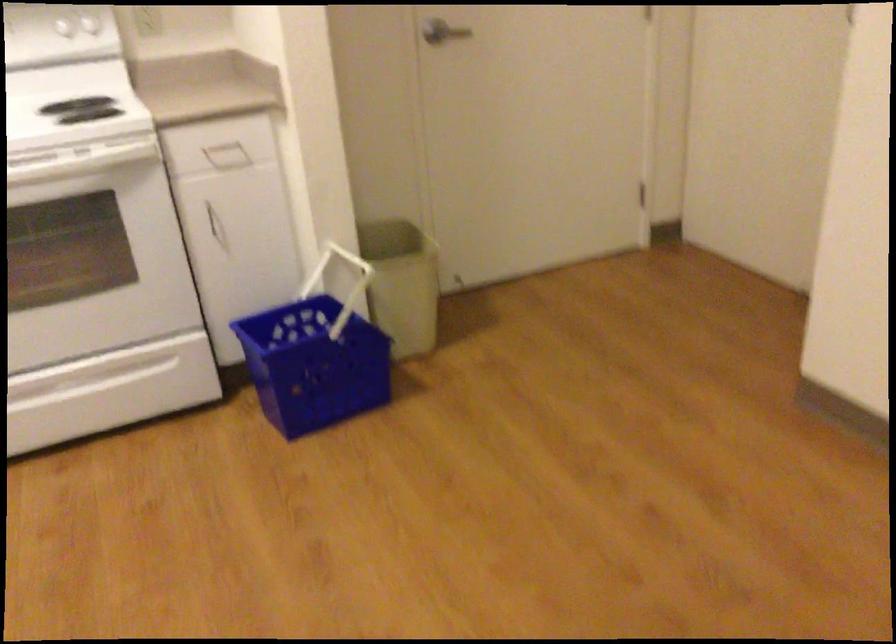
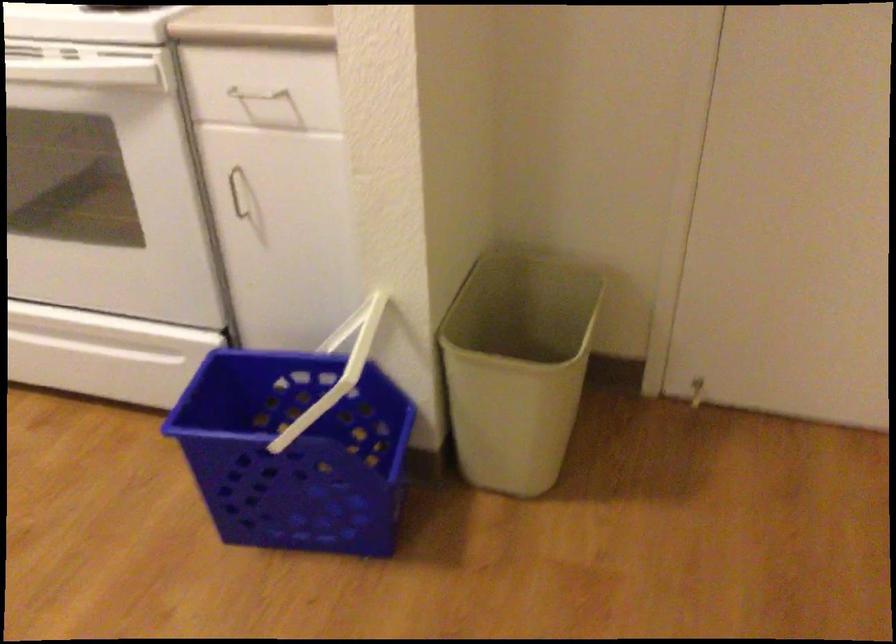
Where in the second image is the point corresponding to point (210, 146) from the first image?

(253, 98)